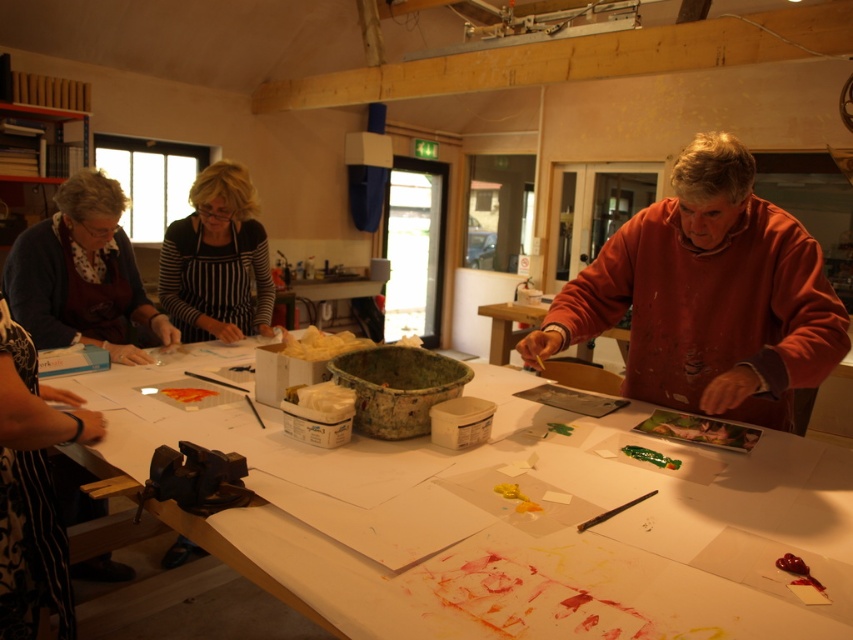
Question: Which point is farther to the camera?

Choices:
 (A) matte black apron at left
 (B) matte orange sweatshirt at right
 (C) matte wooden table at center
 (D) white paper at center

Answer: (C)

Question: Is matte black apron at left to the right of striped apron at center from the viewer's perspective?

Choices:
 (A) no
 (B) yes

Answer: (A)

Question: Does white paper at center have a larger size compared to matte orange sweatshirt at right?

Choices:
 (A) yes
 (B) no

Answer: (A)

Question: Among these points, which one is farthest from the camera?

Choices:
 (A) (822, 323)
 (B) (212, 312)
 (C) (628, 337)

Answer: (C)

Question: Can you confirm if white paper at center is positioned to the left of matte black apron at left?

Choices:
 (A) no
 (B) yes

Answer: (A)

Question: Which of the following is the farthest from the observer?

Choices:
 (A) (199, 323)
 (B) (526, 353)

Answer: (A)